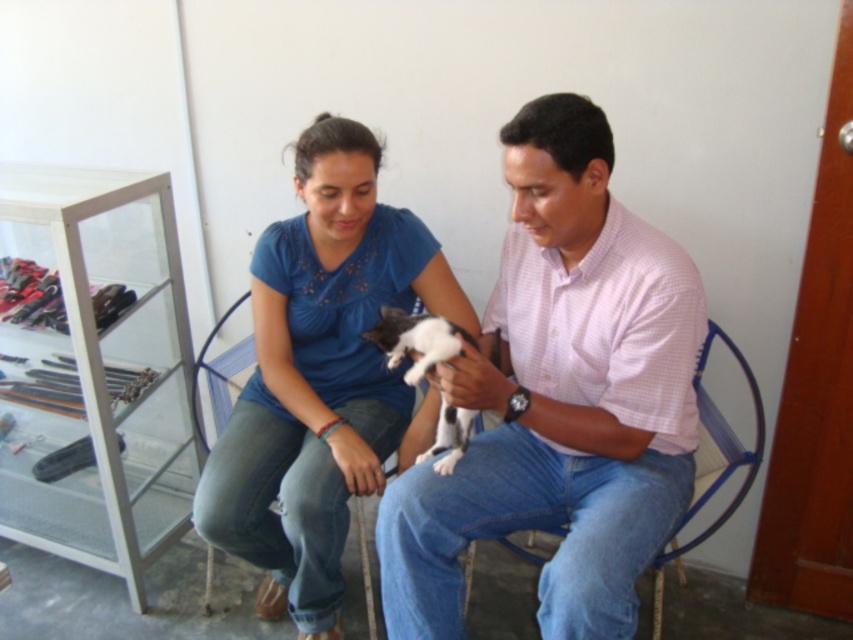
Is point (502, 259) farther from viewer compared to point (271, 541)?

No, it is in front of (271, 541).

Looking at this image, which is above, pink checkered shirt at center or blue cotton shirt at center?

pink checkered shirt at center is higher up.

Locate an element on the screen. This screenshot has width=853, height=640. pink checkered shirt at center is located at coordinates (560, 397).

Between point (635, 225) and point (451, 419), which one is positioned behind?

The point (451, 419) is behind.

Between point (606, 340) and point (392, 340), which one is positioned in front?

Point (606, 340)

The width and height of the screenshot is (853, 640). What do you see at coordinates (560, 397) in the screenshot?
I see `pink checkered shirt at center` at bounding box center [560, 397].

Where is `pink checkered shirt at center`? The width and height of the screenshot is (853, 640). pink checkered shirt at center is located at coordinates (560, 397).

Which is above, pink checkered shirt at center or blue woven chair at center?

pink checkered shirt at center is higher up.

Is point (584, 134) positioned before point (747, 461)?

Yes, point (584, 134) is closer to viewer.

Is point (523, 193) farther from viewer compared to point (722, 438)?

No, it is not.

Where is `pink checkered shirt at center`? This screenshot has height=640, width=853. pink checkered shirt at center is located at coordinates (560, 397).